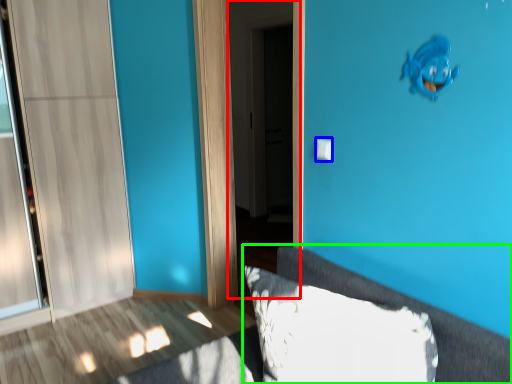
Question: Based on their relative distances, which object is nearer to screen door (highlighted by a red box)? Choose from light switch (highlighted by a blue box) and furniture (highlighted by a green box).

Choices:
 (A) light switch
 (B) furniture

Answer: (A)